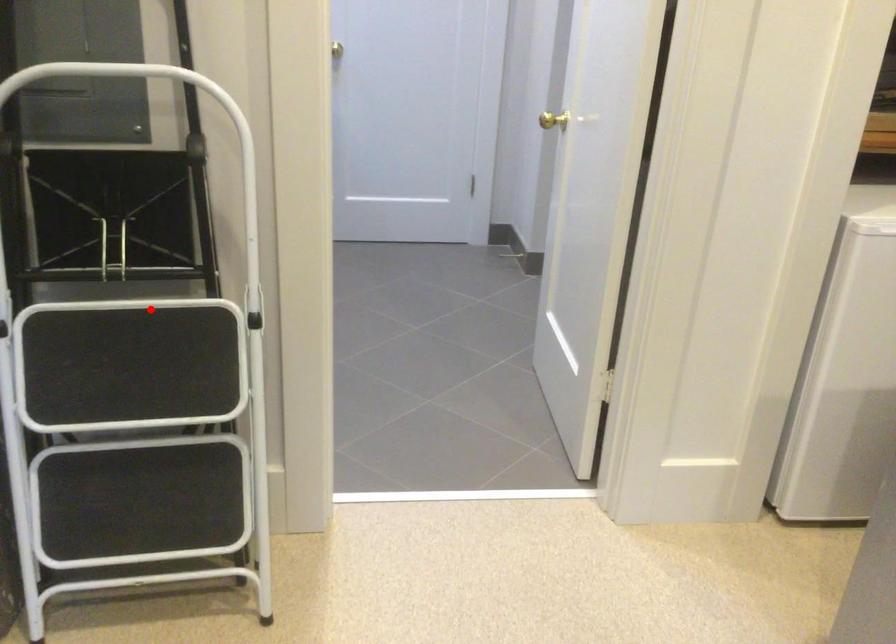
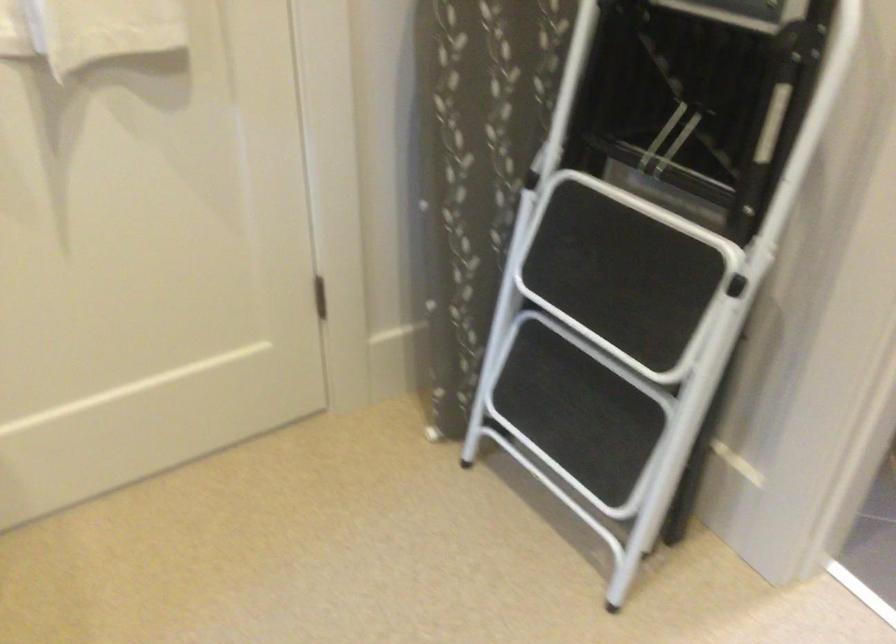
Locate, in the second image, the point that corresponds to the highlighted location in the first image.

(658, 216)